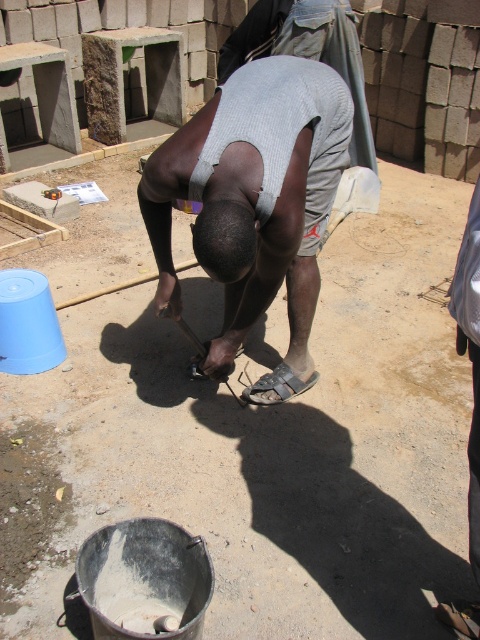
You are a construction worker who needs to locate your gray fabric shirt at center and metallic silver shovel at lower center. Based on the scene, which object is positioned more to the right?

The gray fabric shirt at center is positioned to the right of the metallic silver shovel at lower center, so the gray fabric shirt at center is more to the right.

You are a construction worker standing at the point labeled as point (x=254, y=202) in the image. You need to move to the blue plastic bucket located to the left side of the frame. Which direction should you move relative to your current position?

The point (x=254, y=202) corresponds to the gray fabric shirt at center. Since the blue plastic bucket is to the left side of the frame, you should move to your left to reach it.